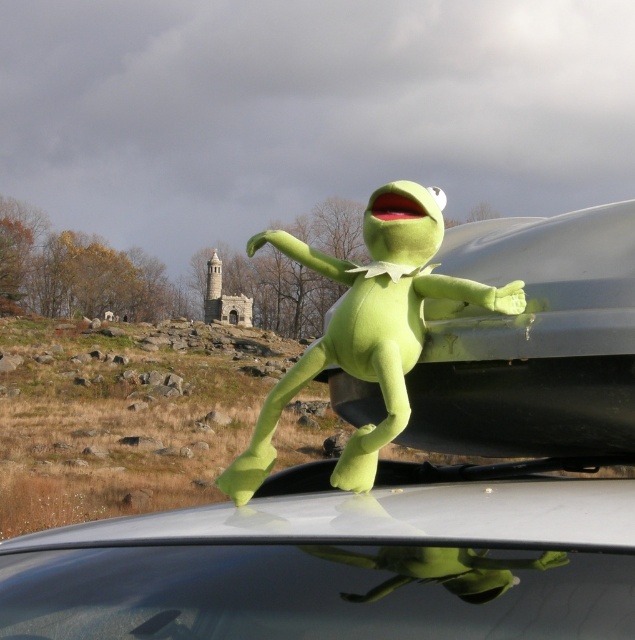
You are standing in front of the car with the Kermit the Frog plush toy on its roof. There are two points marked on the car roof, one at coordinates point (385, 568) and another at point (307, 264). If you were to walk towards the car from your current position, which point would you encounter first?

Point (385, 568) is in front of point (307, 264), so you would encounter point (385, 568) first as you approach the car.

You are a delivery person trying to place a metallic gray car at center and a green plush toy at center on a shelf. The shelf has limited space. Based on their positions in the image, which object should you place first to ensure both fit properly?

The metallic gray car at center is positioned over green plush toy at center in the image, which means the car is larger than the toy. To ensure both fit on the shelf, place the larger metallic gray car at center first, then the smaller green plush toy at center.

You are a delivery person trying to place a large package on the roof of the metallic gray car at center. The package is as tall as the green plush toy at center. Will the package fit on the roof without exceeding the height limit?

The metallic gray car at center is shorter than the green plush toy at center. Since the package is as tall as the green plush toy at center, it will exceed the car roof height limit and not fit.